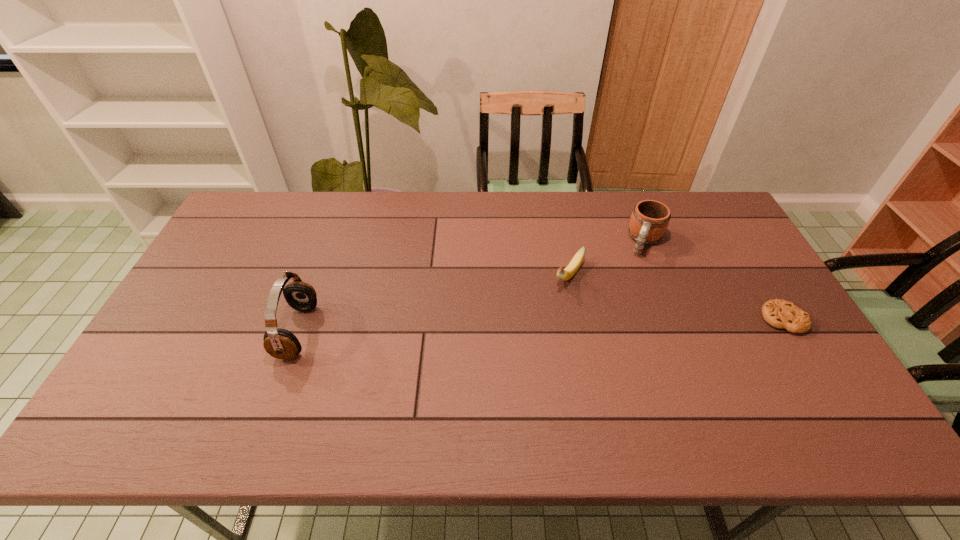
At what (x,y) coordinates should I click in order to perform the action: click on vacant area situated 0.070m on the side of the second tallest object with the handle. Please return your answer as a coordinate pair (x, y). Image resolution: width=960 pixels, height=540 pixels. Looking at the image, I should click on (637, 271).

The height and width of the screenshot is (540, 960). I want to click on free region located on the side of the second tallest object with the handle, so click(x=627, y=297).

You are a GUI agent. You are given a task and a screenshot of the screen. Output one action in this format:
    pyautogui.click(x=<x>, y=<y>)
    Task: Click on the vacant space located on the side of the second tallest object with the handle
    The height and width of the screenshot is (540, 960).
    Given the screenshot: What is the action you would take?
    pyautogui.click(x=607, y=350)

Image resolution: width=960 pixels, height=540 pixels. In order to click on free region located 0.290m at the stem of the third tallest object in this screenshot , I will do `click(509, 359)`.

Locate an element on the screen. vacant region located 0.300m at the stem of the third tallest object is located at coordinates (506, 362).

Find the location of a particular element. The height and width of the screenshot is (540, 960). vacant area situated 0.190m at the stem of the third tallest object is located at coordinates (528, 333).

This screenshot has height=540, width=960. What are the coordinates of `object at the far edge` in the screenshot? It's located at (649, 220).

Identify the location of object that is at the right edge. This screenshot has height=540, width=960. (781, 314).

I want to click on free space at the far edge of the desktop, so click(486, 214).

In order to click on vacant space at the near edge of the desktop in this screenshot , I will do `click(303, 386)`.